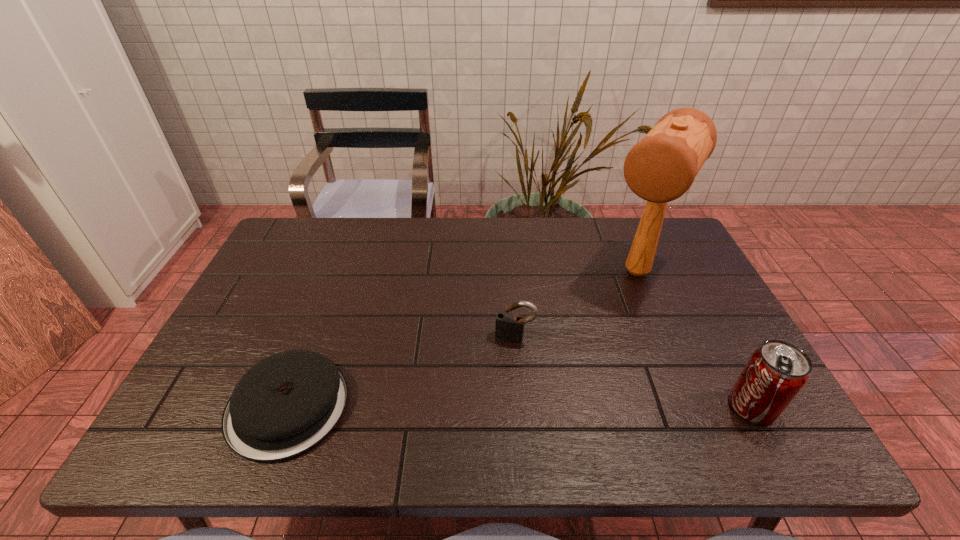
At what (x,y) coordinates should I click in order to perform the action: click on mallet situated at the right edge. Please return your answer as a coordinate pair (x, y). Looking at the image, I should click on (660, 168).

The height and width of the screenshot is (540, 960). I want to click on object that is at the near left corner, so tap(287, 403).

At what (x,y) coordinates should I click in order to perform the action: click on object that is at the far right corner. Please return your answer as a coordinate pair (x, y). Looking at the image, I should click on (660, 168).

You are a GUI agent. You are given a task and a screenshot of the screen. Output one action in this format:
    pyautogui.click(x=<x>, y=<y>)
    Task: Click on the object that is at the near right corner
    This screenshot has height=540, width=960.
    Given the screenshot: What is the action you would take?
    pyautogui.click(x=776, y=372)

Identify the location of free space at the far edge of the desktop. This screenshot has height=540, width=960. (367, 258).

Image resolution: width=960 pixels, height=540 pixels. In the image, there is a desktop. In order to click on vacant space at the near edge in this screenshot , I will do `click(487, 406)`.

I want to click on free space at the left edge of the desktop, so click(227, 354).

Where is `free point at the right edge`? This screenshot has width=960, height=540. free point at the right edge is located at coordinates (733, 352).

Locate an element on the screen. This screenshot has width=960, height=540. vacant region at the far left corner of the desktop is located at coordinates (285, 231).

The height and width of the screenshot is (540, 960). In order to click on free spot at the far right corner of the desktop in this screenshot , I will do `click(632, 227)`.